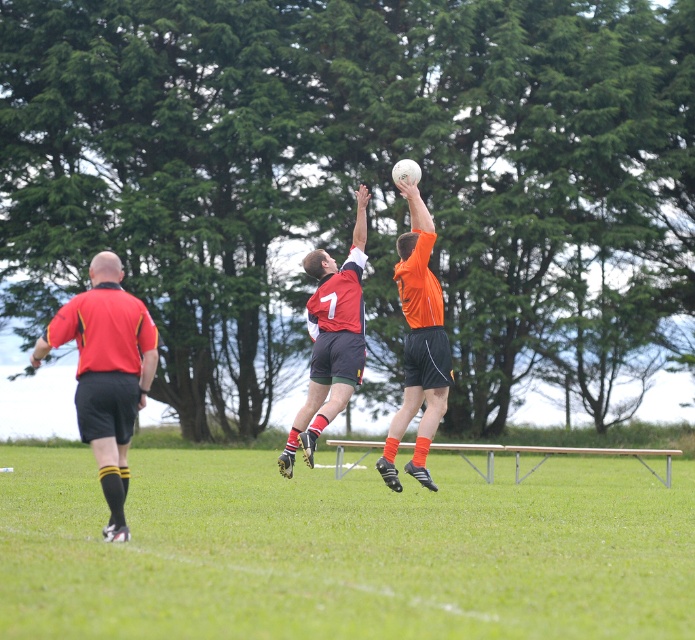
Who is more forward, (496, 564) or (341, 280)?

Point (496, 564) is more forward.

Consider the image. Is green grass at center behind red jersey at center?

No, it is in front of red jersey at center.

This screenshot has height=640, width=695. What do you see at coordinates (343, 548) in the screenshot?
I see `green grass at center` at bounding box center [343, 548].

The height and width of the screenshot is (640, 695). I want to click on green grass at center, so click(343, 548).

Identify the location of matte red shirt at left. (106, 372).

Which is more to the left, matte red shirt at left or metallic silver rail at center?

From the viewer's perspective, matte red shirt at left appears more on the left side.

Identify the location of matte red shirt at left. (106, 372).

Who is lower down, green grass at center or orange matte jersey at center?

Positioned lower is green grass at center.

At what (x,y) coordinates should I click in order to perform the action: click on green grass at center. Please return your answer as a coordinate pair (x, y). This screenshot has height=640, width=695. Looking at the image, I should click on (343, 548).